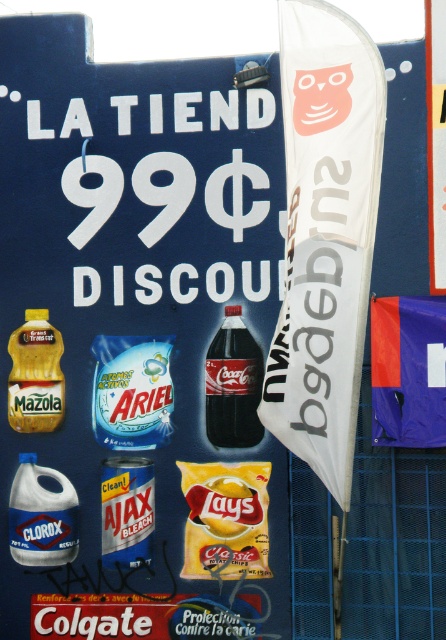
Locate an element on the screen. yellow matte lay's potato chips at center is located at coordinates (226, 518).

Locate an element on the screen. yellow matte lay's potato chips at center is located at coordinates (226, 518).

Between yellow matte lay's potato chips at center and dark brown glass bottle at center, which one appears on the right side from the viewer's perspective?

Positioned to the right is dark brown glass bottle at center.

Is yellow matte lay's potato chips at center thinner than dark brown glass bottle at center?

No, yellow matte lay's potato chips at center is not thinner than dark brown glass bottle at center.

Which is in front, point (202, 541) or point (228, 406)?

Positioned in front is point (228, 406).

You are a GUI agent. You are given a task and a screenshot of the screen. Output one action in this format:
    pyautogui.click(x=<x>, y=<y>)
    Task: Click on the yellow matte lay's potato chips at center
    The width and height of the screenshot is (446, 640).
    Given the screenshot: What is the action you would take?
    pyautogui.click(x=226, y=518)

Is blue glossy detergent at center taller than dark brown glass bottle at center?

Incorrect, blue glossy detergent at center's height is not larger of dark brown glass bottle at center's.

Is blue glossy detergent at center shorter than dark brown glass bottle at center?

Correct, blue glossy detergent at center is not as tall as dark brown glass bottle at center.

Between point (148, 387) and point (256, 444), which one is positioned in front?

Point (256, 444)

Where is `blue glossy detergent at center`? Image resolution: width=446 pixels, height=640 pixels. blue glossy detergent at center is located at coordinates (132, 392).